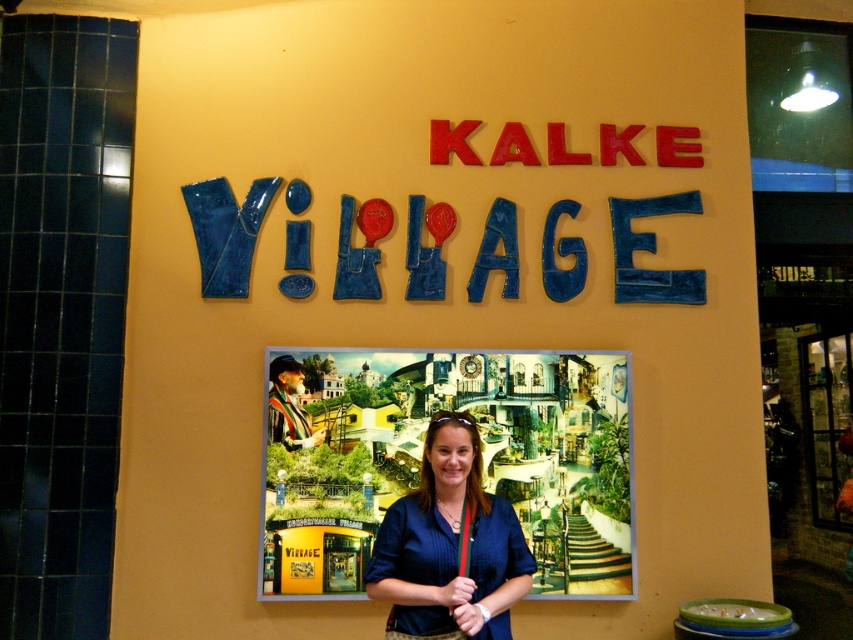
You are a tourist standing in front of the wall with the sign. You want to take a photo of the colorful painted poster at center without the blue fabric shirt at center blocking it. Is the poster visible from your current position?

The colorful painted poster at center is positioned under the blue fabric shirt at center, so the shirt is blocking the poster. To take a photo of the poster without the shirt blocking it, you would need to move either yourself or the shirt to ensure the poster is fully visible.

You are standing in front of the wall described in the scene. There is a colorful painted poster at center. Can you determine the exact coordinates of the poster?

The colorful painted poster at center is located at point (424,460) according to the provided description.